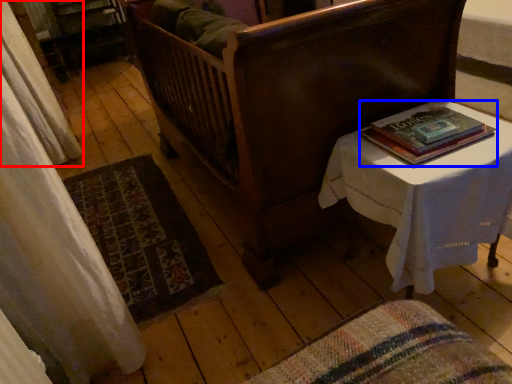
Question: Among these objects, which one is farthest to the camera, curtain (highlighted by a red box) or book (highlighted by a blue box)?

Choices:
 (A) curtain
 (B) book

Answer: (A)